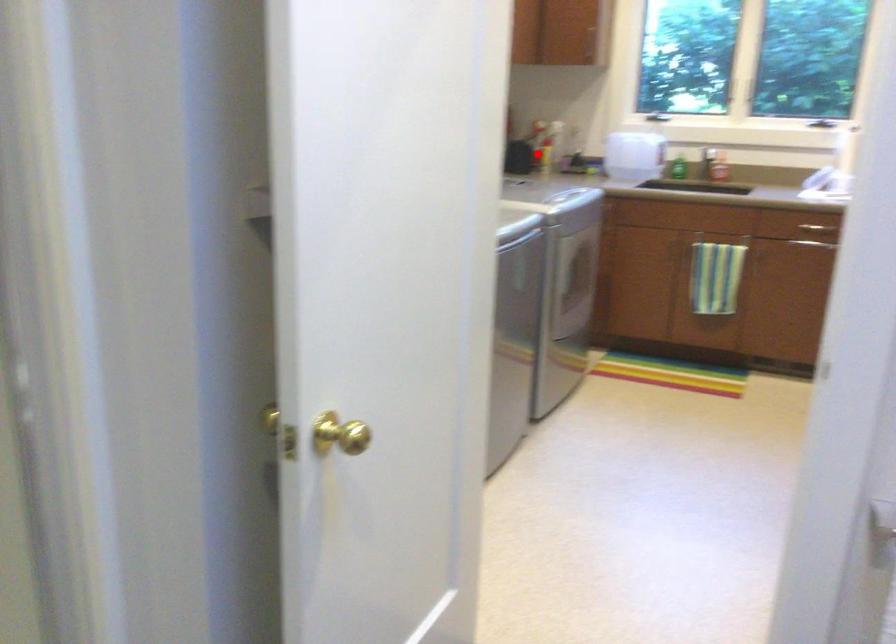
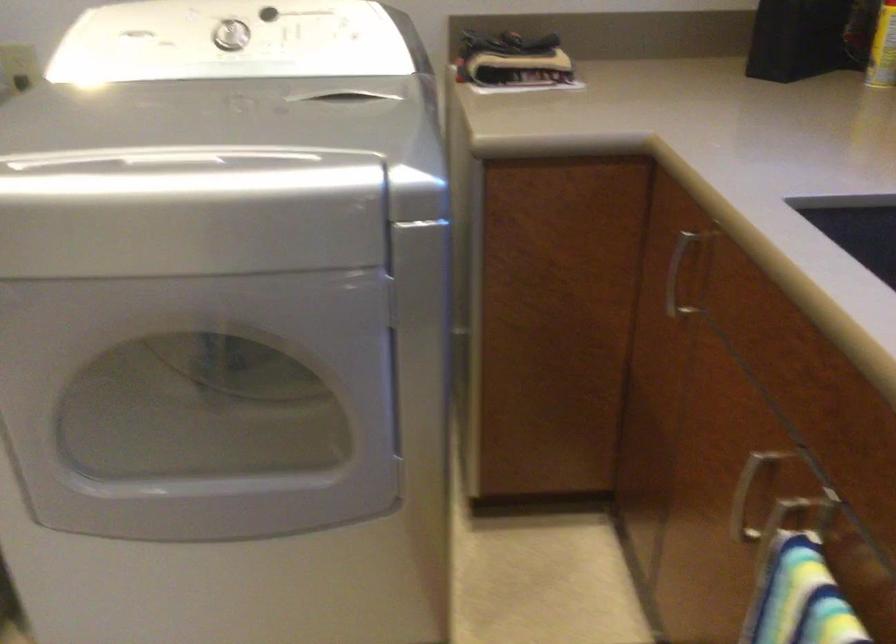
Locate, in the second image, the point that corresponds to the highlighted location in the first image.

(883, 49)